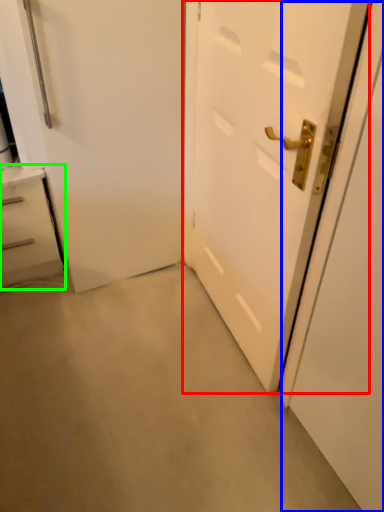
Question: Which object is the farthest from door (highlighted by a red box)? Choose among these: screen door (highlighted by a blue box) or chest of drawers (highlighted by a green box).

Choices:
 (A) screen door
 (B) chest of drawers

Answer: (B)